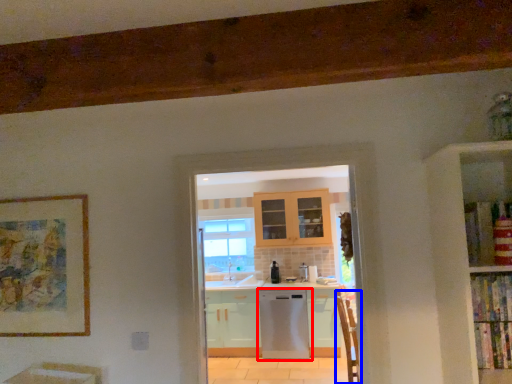
Question: Which point is closer to the camera, home appliance (highlighted by a red box) or armchair (highlighted by a blue box)?

Choices:
 (A) home appliance
 (B) armchair

Answer: (B)